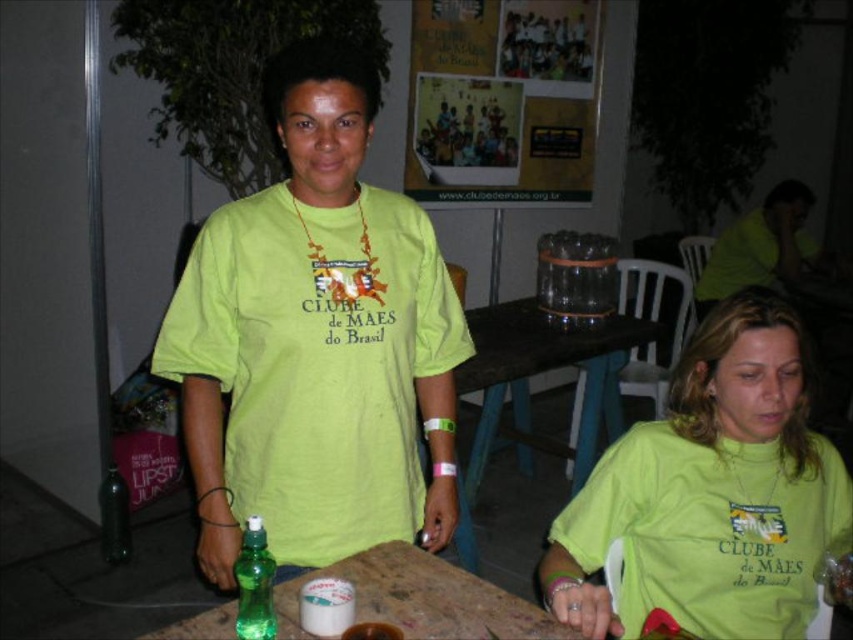
Consider the image. Is green matte t-shirt at center to the left of green plastic bottle at lower left from the viewer's perspective?

Incorrect, green matte t-shirt at center is not on the left side of green plastic bottle at lower left.

I want to click on green matte t-shirt at center, so click(x=316, y=340).

Is wooden table at center further to camera compared to green plastic bottle at lower left?

No, it is not.

Which of these two, wooden table at center or green plastic bottle at lower left, stands shorter?

green plastic bottle at lower left is shorter.

Between point (508, 348) and point (103, 488), which one is positioned in front?

Point (508, 348) is more forward.

You are a GUI agent. You are given a task and a screenshot of the screen. Output one action in this format:
    pyautogui.click(x=<x>, y=<y>)
    Task: Click on the wooden table at center
    The image size is (853, 640).
    Given the screenshot: What is the action you would take?
    [529, 394]

Describe the element at coordinates (711, 493) in the screenshot. I see `matte green t-shirt at center` at that location.

Which is more to the right, matte green t-shirt at center or green matte spray bottle at center?

matte green t-shirt at center

Image resolution: width=853 pixels, height=640 pixels. In order to click on matte green t-shirt at center in this screenshot , I will do `click(711, 493)`.

At what (x,y) coordinates should I click in order to perform the action: click on matte green t-shirt at center. Please return your answer as a coordinate pair (x, y). The height and width of the screenshot is (640, 853). Looking at the image, I should click on (711, 493).